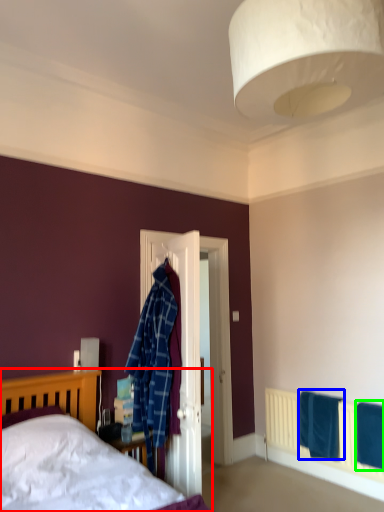
Question: Which object is the closest to the bed (highlighted by a red box)? Choose among these: bath towel (highlighted by a blue box) or bath towel (highlighted by a green box).

Choices:
 (A) bath towel
 (B) bath towel

Answer: (A)